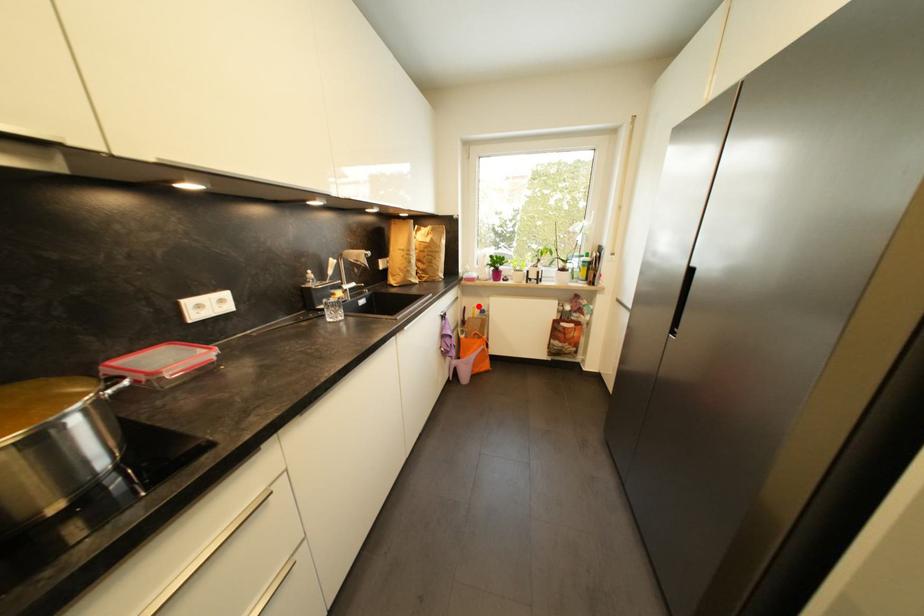
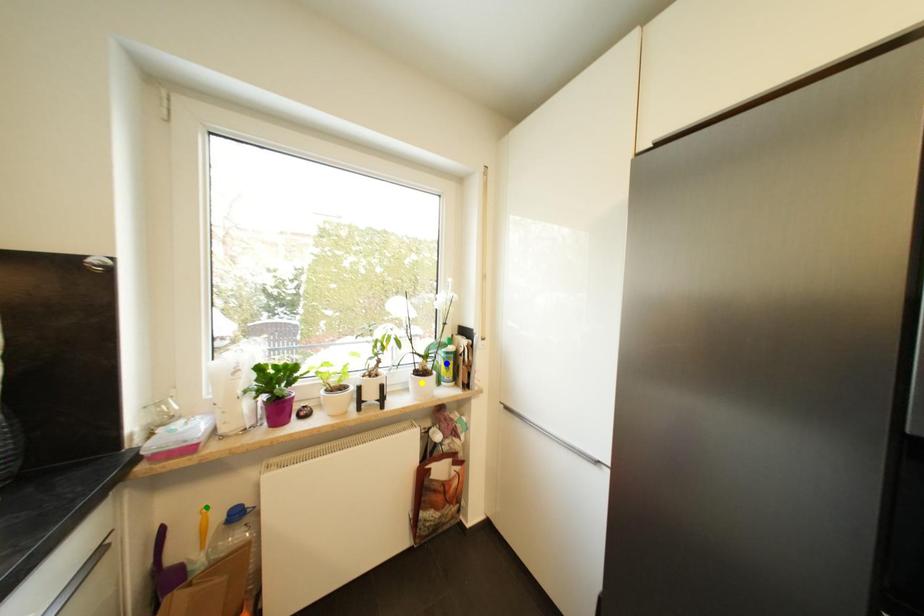
Question: I am providing you with two images of the same scene from different viewpoints. A red point is marked on the first image. You are given multiple points on the second image. In image 2, which mark is for the same physical point as the one in image 1?

Choices:
 (A) green point
 (B) yellow point
 (C) blue point

Answer: (A)